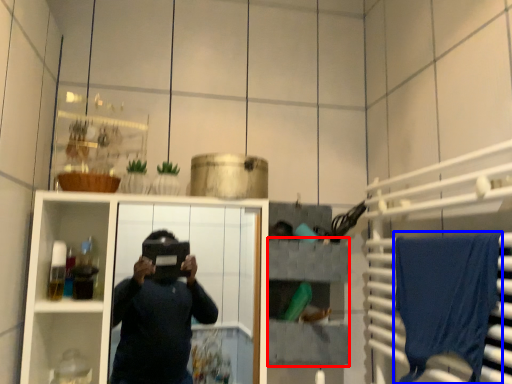
Question: Which of the following is the closest to the observer, shelf (highlighted by a red box) or bath towel (highlighted by a blue box)?

Choices:
 (A) shelf
 (B) bath towel

Answer: (B)